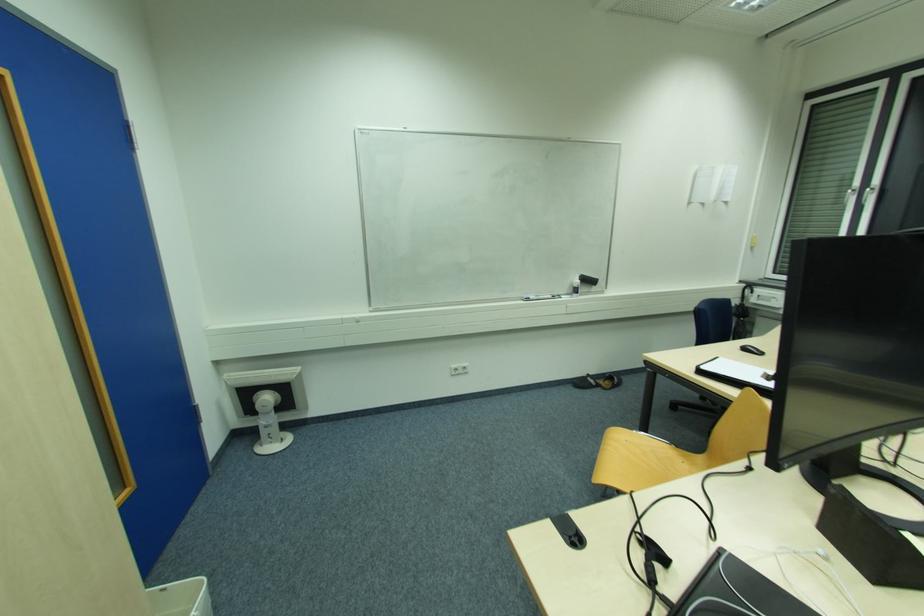
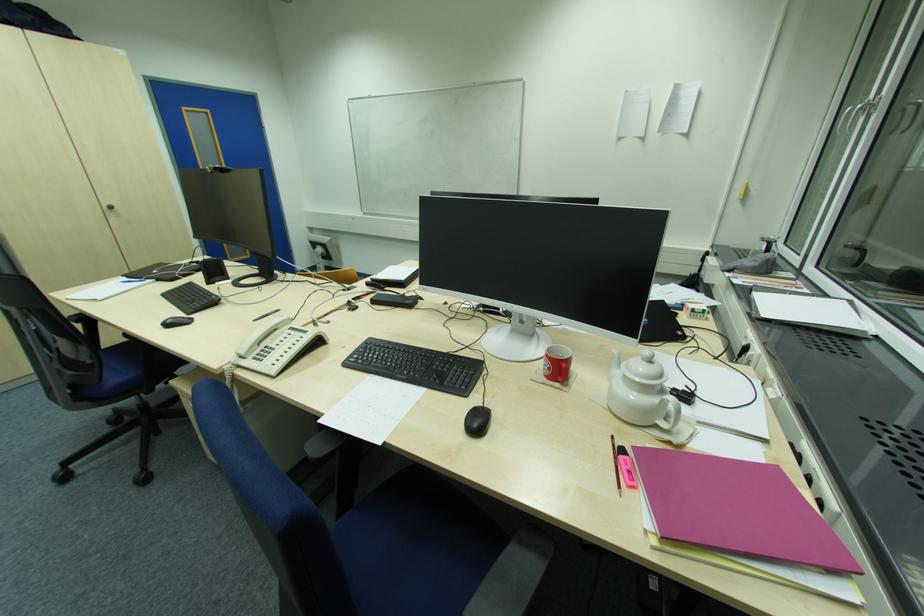
Where in the second image is the point corresponding to the point at 751,384 from the first image?

(381, 275)